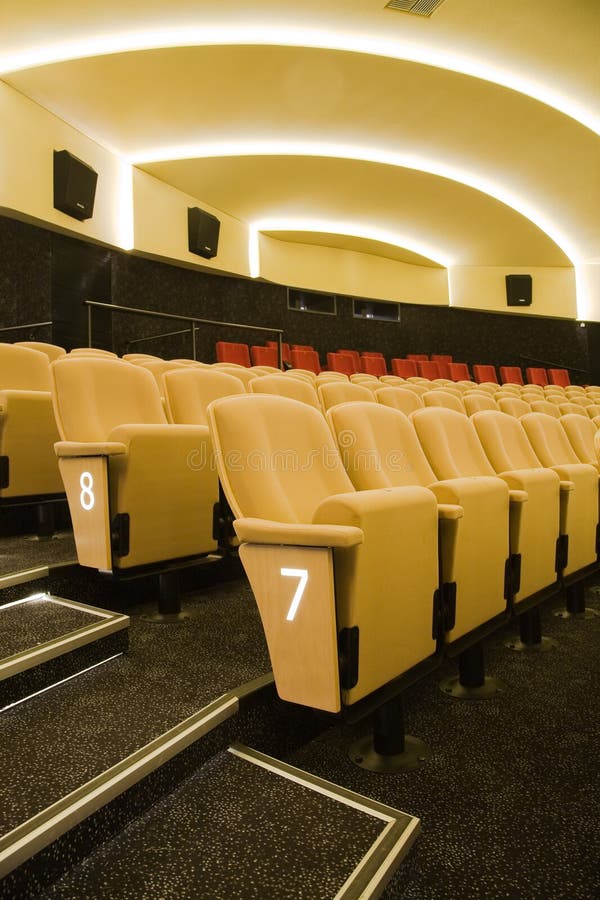
At what (x,y) coordinates should I click in order to perform the action: click on armrest on movie seat. Please return your answer as a coordinate pair (x, y). The width and height of the screenshot is (600, 900). Looking at the image, I should click on (566, 484), (517, 496), (448, 510), (326, 534), (84, 446).